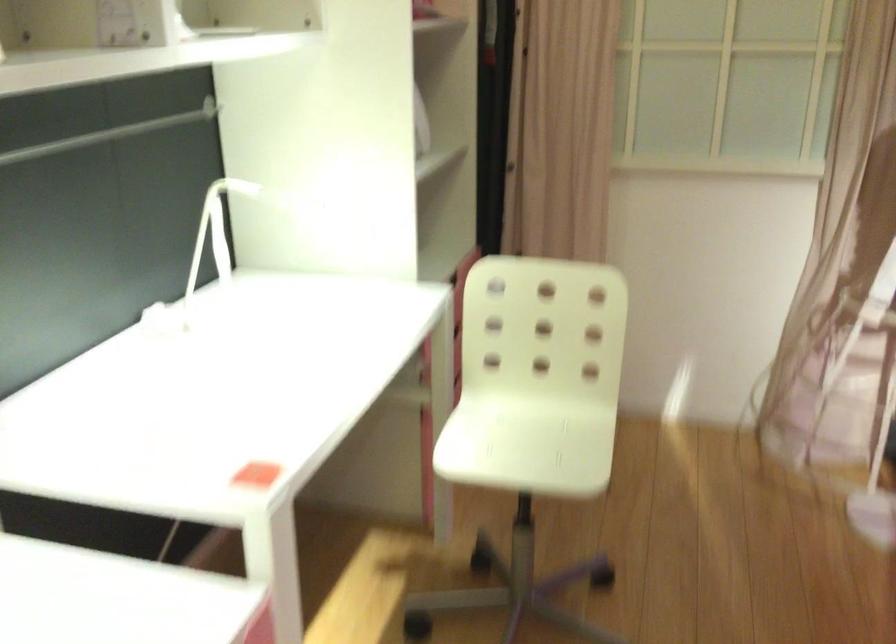
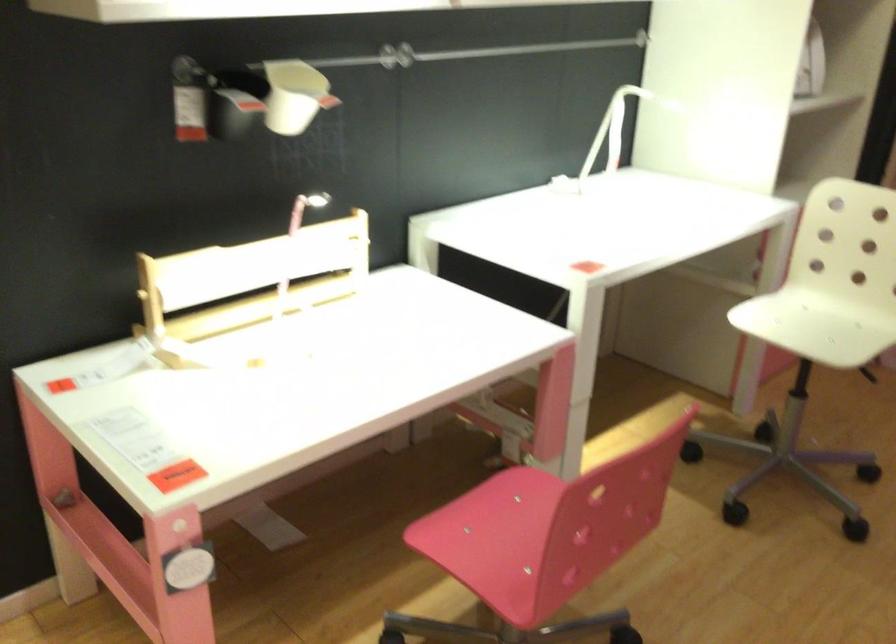
In the second image, find the point that corresponds to pixel 526 440 in the first image.

(812, 327)